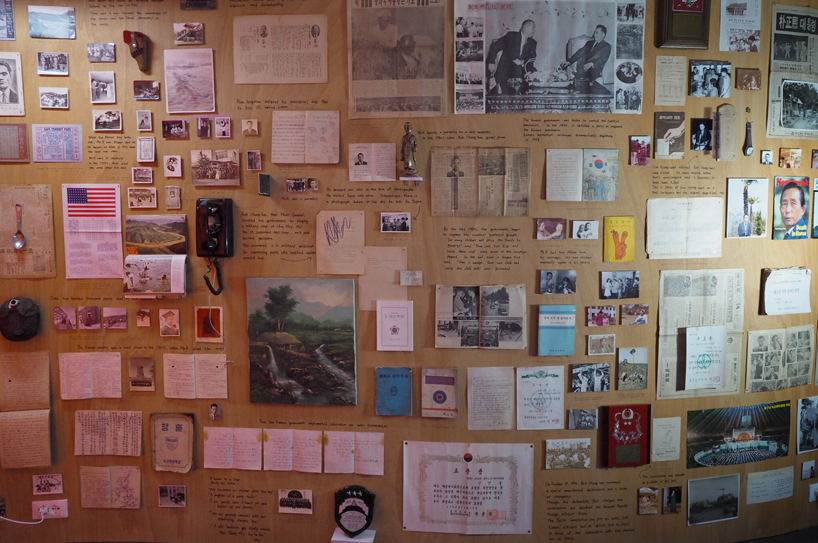
I want to click on canvas, so click(x=252, y=283).